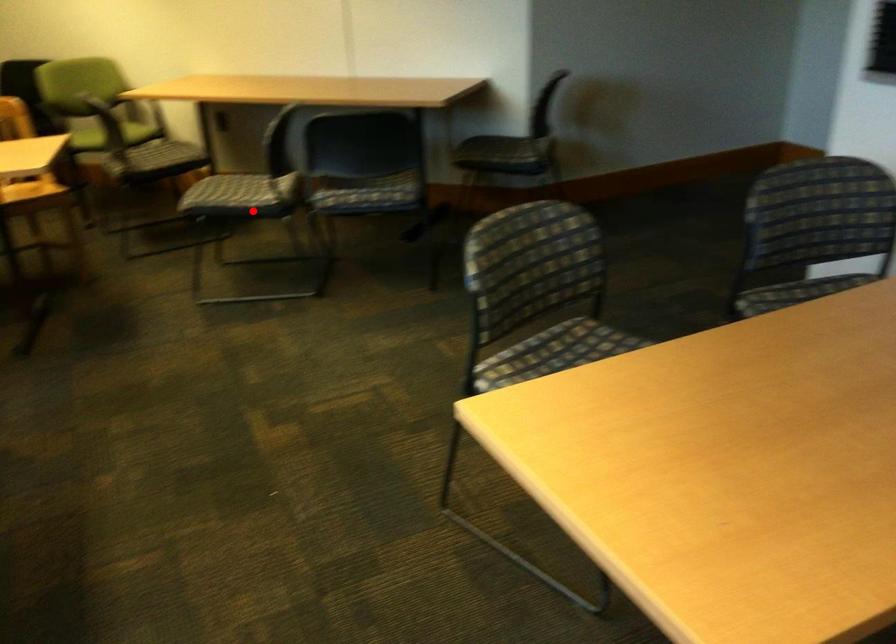
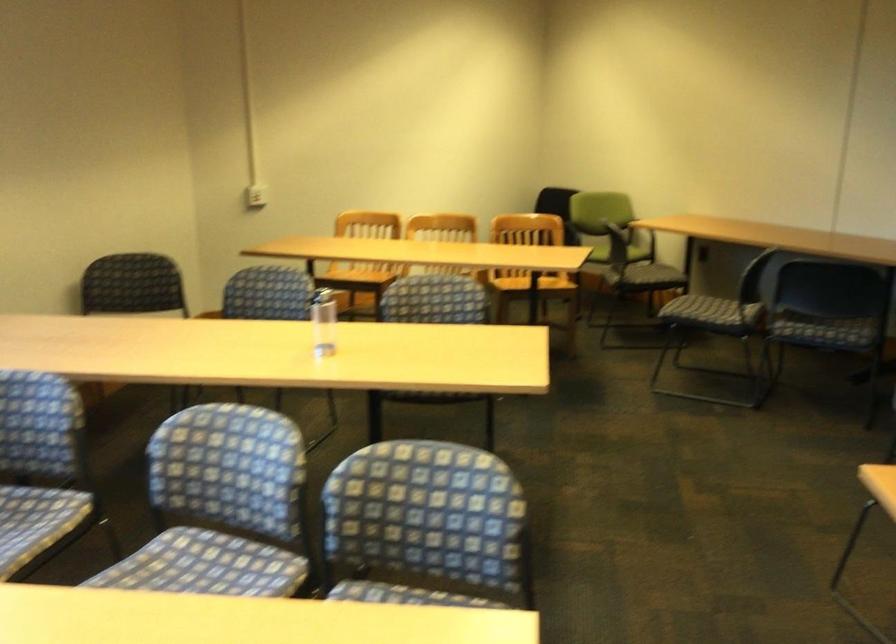
Question: A red point is marked in image1. In image2, is the corresponding 3D point closer to the camera or farther? Reply with the corresponding letter.

Choices:
 (A) The corresponding 3D point is closer.
 (B) The corresponding 3D point is farther.

Answer: (B)